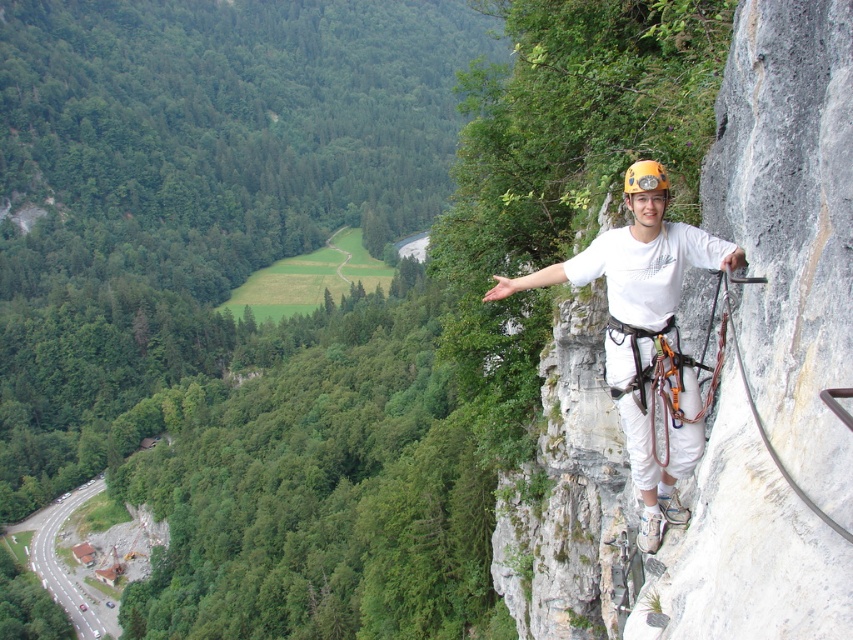
Which of these two, white matte helmet at upper right or yellow matte helmet at upper right, stands taller?

white matte helmet at upper right

Does point (672, 236) lie behind point (630, 177)?

Yes, it is.

Who is more forward, (654, 196) or (659, 186)?

Positioned in front is point (659, 186).

What are the coordinates of `white matte helmet at upper right` in the screenshot? It's located at (641, 336).